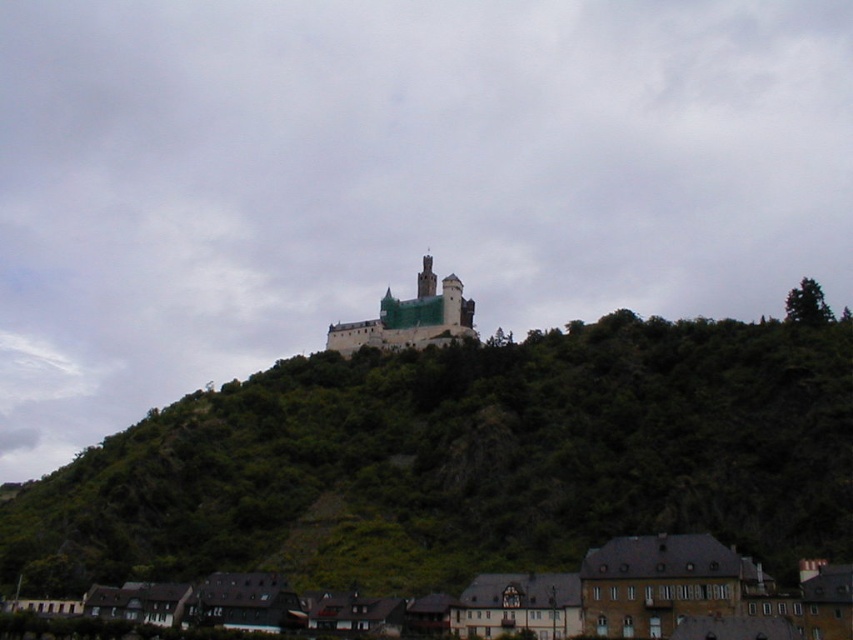
Question: Can you confirm if green leafy hillside at center is positioned to the right of brown stone buildings at lower center?

Choices:
 (A) yes
 (B) no

Answer: (B)

Question: Among these objects, which one is nearest to the camera?

Choices:
 (A) green leafy hillside at center
 (B) brown stone buildings at lower center
 (C) stone medieval castle at center

Answer: (B)

Question: Does green leafy hillside at center appear on the right side of brown stone buildings at lower center?

Choices:
 (A) yes
 (B) no

Answer: (B)

Question: Which of the following is the closest to the observer?

Choices:
 (A) green leafy hillside at center
 (B) brown stone buildings at lower center

Answer: (B)

Question: Considering the relative positions of brown stone buildings at lower center and stone medieval castle at center in the image provided, where is brown stone buildings at lower center located with respect to stone medieval castle at center?

Choices:
 (A) left
 (B) right

Answer: (B)

Question: Which point is closer to the camera?

Choices:
 (A) pos(381,340)
 (B) pos(769,636)

Answer: (B)